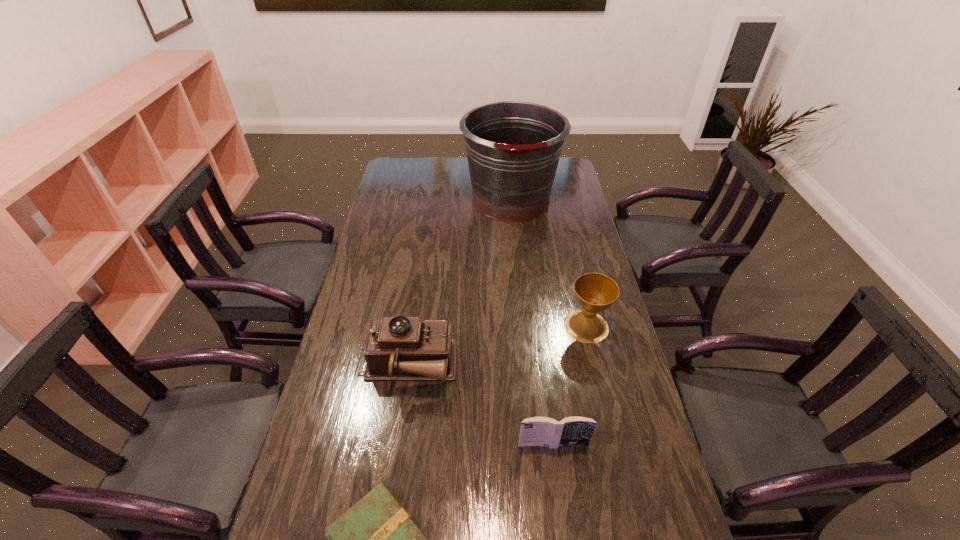
The height and width of the screenshot is (540, 960). Find the location of `bucket`. bucket is located at coordinates (513, 148).

You are a GUI agent. You are given a task and a screenshot of the screen. Output one action in this format:
    pyautogui.click(x=<x>, y=<y>)
    Task: Click on the tallest object
    
    Given the screenshot: What is the action you would take?
    pyautogui.click(x=513, y=148)

Locate an element on the screen. chalice is located at coordinates (595, 292).

Identify the location of phonograph_record. This screenshot has width=960, height=540. point(400,348).

This screenshot has height=540, width=960. In order to click on the farther book in this screenshot , I will do `click(537, 431)`.

What are the coordinates of `the right book` in the screenshot? It's located at click(537, 431).

In order to click on vacant space located on the front of the tallest object in this screenshot , I will do `click(516, 253)`.

You are a GUI agent. You are given a task and a screenshot of the screen. Output one action in this format:
    pyautogui.click(x=<x>, y=<y>)
    Task: Click on the blank space located on the left of the chalice
    
    Given the screenshot: What is the action you would take?
    pyautogui.click(x=467, y=326)

Locate an element on the screen. The width and height of the screenshot is (960, 540). free location located 0.390m on the horn of the phonograph_record is located at coordinates (589, 367).

At what (x,y) coordinates should I click in order to perform the action: click on free point located on the front cover of the fourth tallest object. Please return your answer as a coordinate pair (x, y). Looking at the image, I should click on (560, 499).